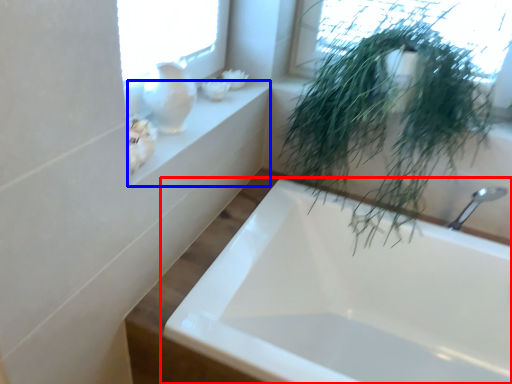
Question: Among these objects, which one is nearest to the camera, bathtub (highlighted by a red box) or window sill (highlighted by a blue box)?

Choices:
 (A) bathtub
 (B) window sill

Answer: (A)